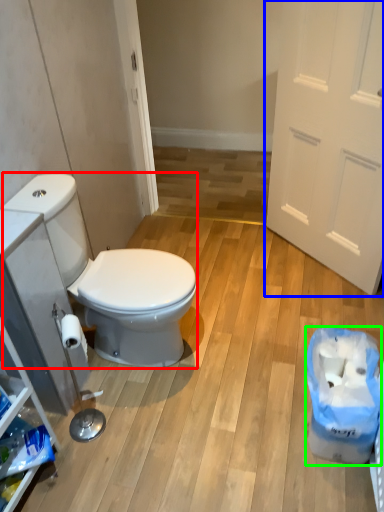
Question: Considering the real-world distances, which object is farthest from sit (highlighted by a red box)? door (highlighted by a blue box) or recycling bin (highlighted by a green box)?

Choices:
 (A) door
 (B) recycling bin

Answer: (A)